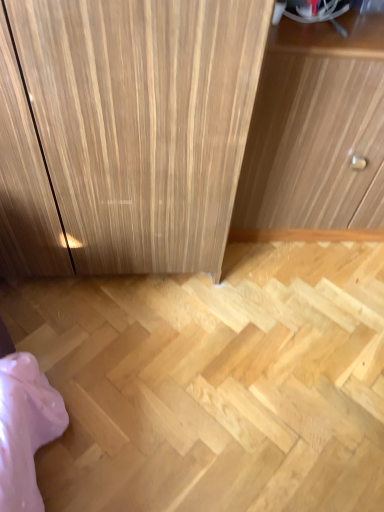
What do you see at coordinates (316, 129) in the screenshot? I see `wooden cabinet at upper right` at bounding box center [316, 129].

Image resolution: width=384 pixels, height=512 pixels. I want to click on wooden cabinet at upper right, so point(316,129).

In order to face wooden cabinet at upper right, should I rotate leftwards or rightwards?

A 20.302 degree turn to the right will do.

Where is `wooden cabinet at upper right`? This screenshot has height=512, width=384. wooden cabinet at upper right is located at coordinates (316, 129).